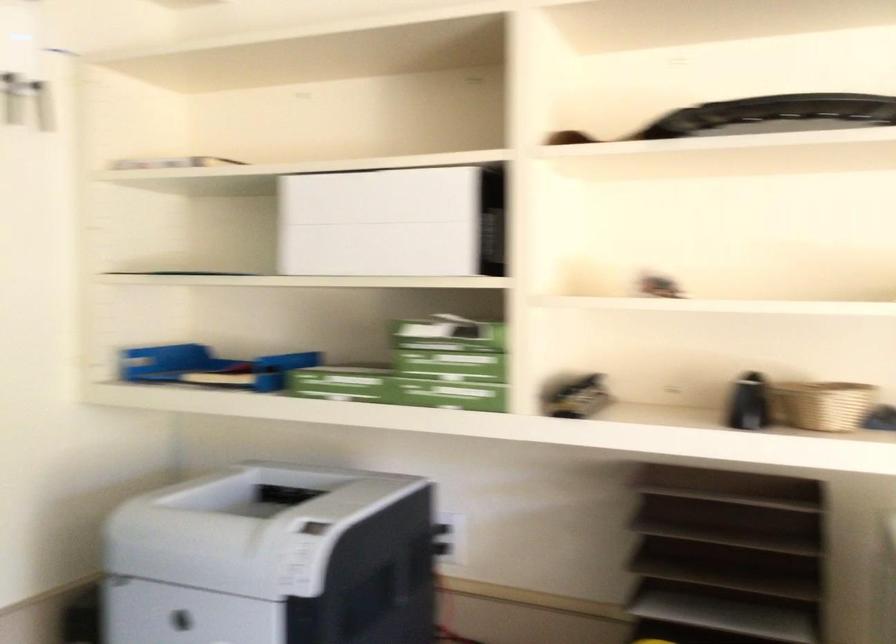
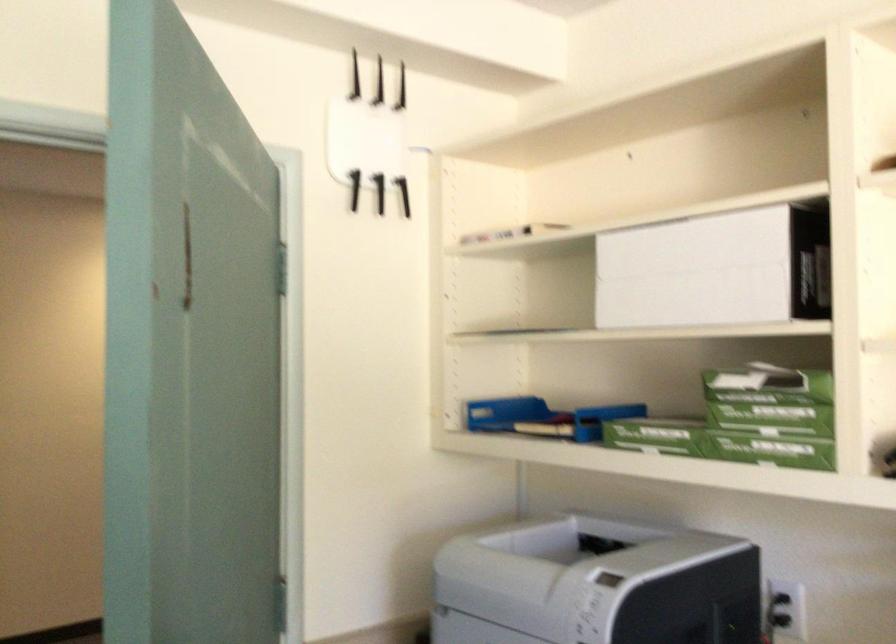
Where in the second image is the point corresponding to [409,220] from the first image?

(716, 269)